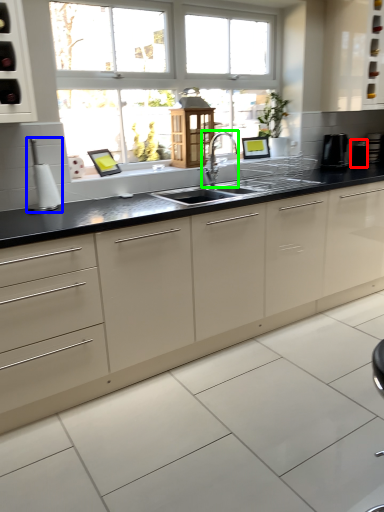
Question: Which object is the farthest from appliance (highlighted by a red box)? Choose among these: appliance (highlighted by a blue box) or tap (highlighted by a green box).

Choices:
 (A) appliance
 (B) tap

Answer: (A)